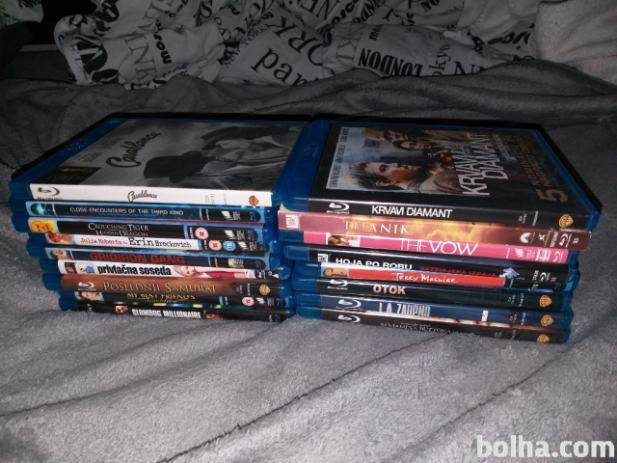
Locate an element on the screen. dvds in right stack is located at coordinates (436, 213), (418, 228), (453, 248), (418, 261), (400, 274), (413, 293), (403, 306), (405, 324).